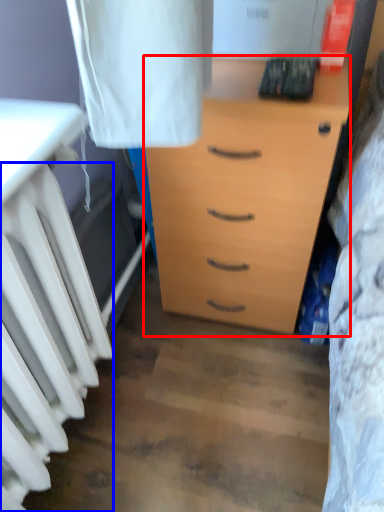
Question: Which object appears closest to the camera in this image, chest of drawers (highlighted by a red box) or radiator (highlighted by a blue box)?

Choices:
 (A) chest of drawers
 (B) radiator

Answer: (B)